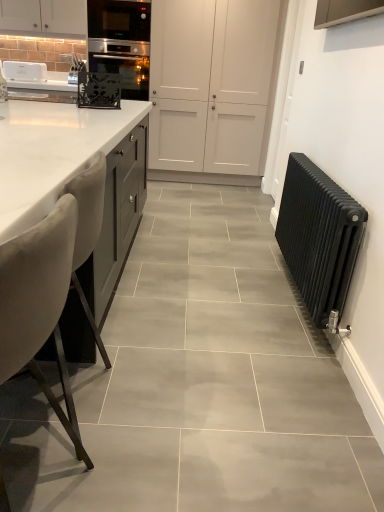
Question: From a real-world perspective, does white matte cabinet at upper center sit lower than velvet beige chair at left?

Choices:
 (A) yes
 (B) no

Answer: (B)

Question: Is white matte cabinet at upper center next to velvet beige chair at left and touching it?

Choices:
 (A) yes
 (B) no

Answer: (B)

Question: Considering the relative sizes of white matte cabinet at upper center and velvet beige chair at left in the image provided, is white matte cabinet at upper center wider than velvet beige chair at left?

Choices:
 (A) yes
 (B) no

Answer: (A)

Question: Considering the relative sizes of white matte cabinet at upper center and velvet beige chair at left in the image provided, is white matte cabinet at upper center bigger than velvet beige chair at left?

Choices:
 (A) no
 (B) yes

Answer: (B)

Question: Can you confirm if white matte cabinet at upper center is positioned to the right of velvet beige chair at left?

Choices:
 (A) no
 (B) yes

Answer: (B)

Question: Considering the relative positions of white matte cabinet at upper center and velvet beige chair at left in the image provided, is white matte cabinet at upper center to the left of velvet beige chair at left from the viewer's perspective?

Choices:
 (A) no
 (B) yes

Answer: (A)

Question: Is velvet beige chair at left further to camera compared to white marble countertop at left?

Choices:
 (A) yes
 (B) no

Answer: (B)

Question: Could you tell me if velvet beige chair at left is facing white marble countertop at left?

Choices:
 (A) yes
 (B) no

Answer: (A)

Question: Does velvet beige chair at left have a greater height compared to white marble countertop at left?

Choices:
 (A) no
 (B) yes

Answer: (A)

Question: Is velvet beige chair at left oriented away from white marble countertop at left?

Choices:
 (A) yes
 (B) no

Answer: (A)

Question: Can you confirm if velvet beige chair at left is bigger than white marble countertop at left?

Choices:
 (A) yes
 (B) no

Answer: (B)

Question: Considering the relative sizes of velvet beige chair at left and white marble countertop at left in the image provided, is velvet beige chair at left smaller than white marble countertop at left?

Choices:
 (A) yes
 (B) no

Answer: (A)

Question: Can you confirm if white matte cabinet at upper center is positioned to the right of white marble countertop at left?

Choices:
 (A) no
 (B) yes

Answer: (B)